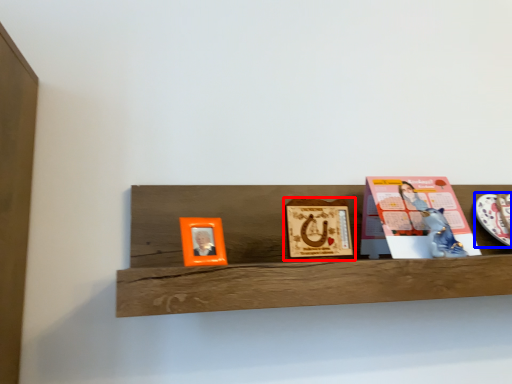
Question: Which object appears closest to the camera in this image, picture frame (highlighted by a red box) or platter (highlighted by a blue box)?

Choices:
 (A) picture frame
 (B) platter

Answer: (A)